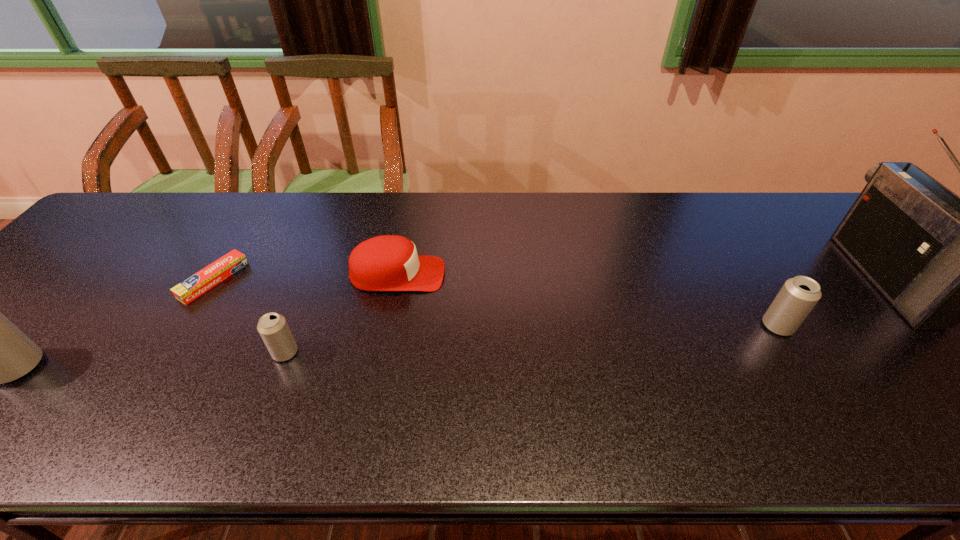
If equal spacing is desired by inserting an extra beer_can among them, please point out a free spot for this new beer_can. Please provide its 2D coordinates. Your answer should be formatted as a tuple, i.e. [(x, y)], where the tuple contains the x and y coordinates of a point satisfying the conditions above.

[(539, 339)]